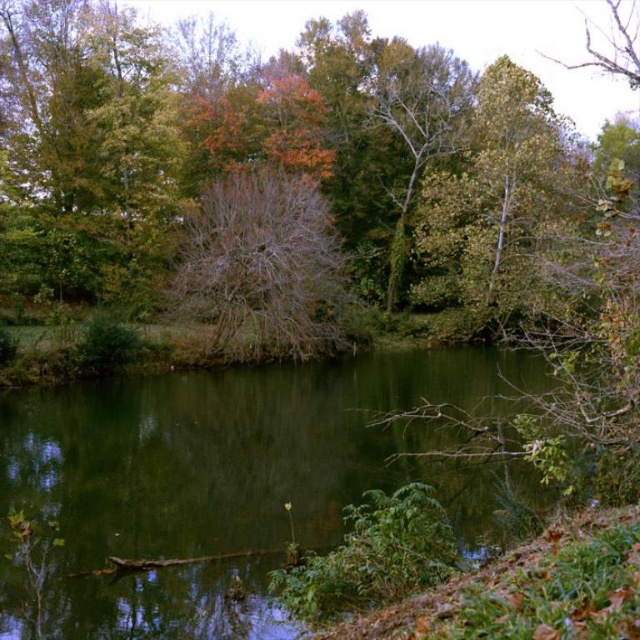
You are standing at the edge of the water and want to know if the green liquid water at center is deeper than the bare branches at center. Can you determine this based on the scene?

The green liquid water at center has a lesser height compared to the bare branches at center, so the water is not deeper than the branches.

You are standing at the edge of the water in the scene. If you walk towards the point labeled as point (227, 483), which object will you encounter first?

The point labeled (227, 483) corresponds to green liquid water at center, so you will encounter the green liquid water at center first as you walk towards that point.